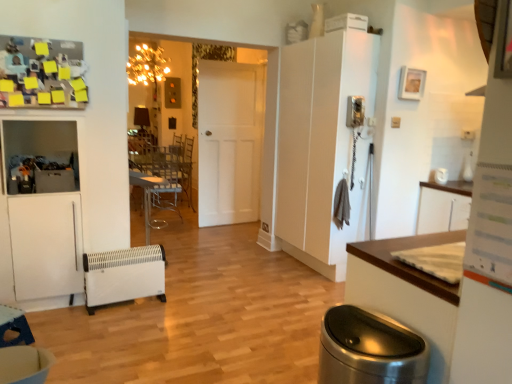
In order to click on vacant region in front of white matte heater at lower left in this screenshot , I will do [x=132, y=326].